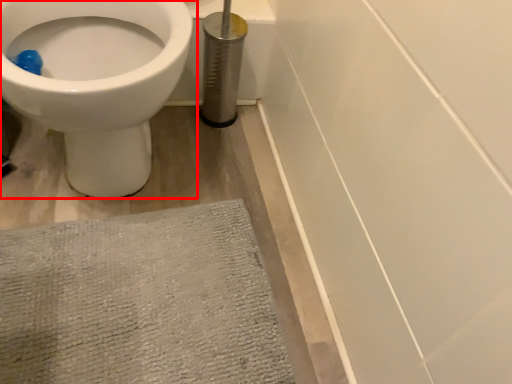
Question: In this image, where is toilet (annotated by the red box) located relative to bath mat?

Choices:
 (A) right
 (B) left

Answer: (B)